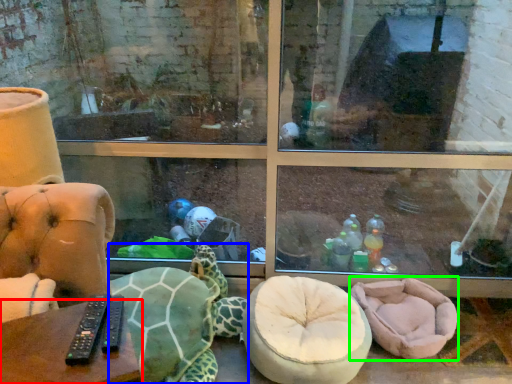
Question: Based on their relative distances, which object is farther from table (highlighted by a red box)? Choose from tortoise (highlighted by a blue box) and bean bag chair (highlighted by a green box).

Choices:
 (A) tortoise
 (B) bean bag chair

Answer: (B)